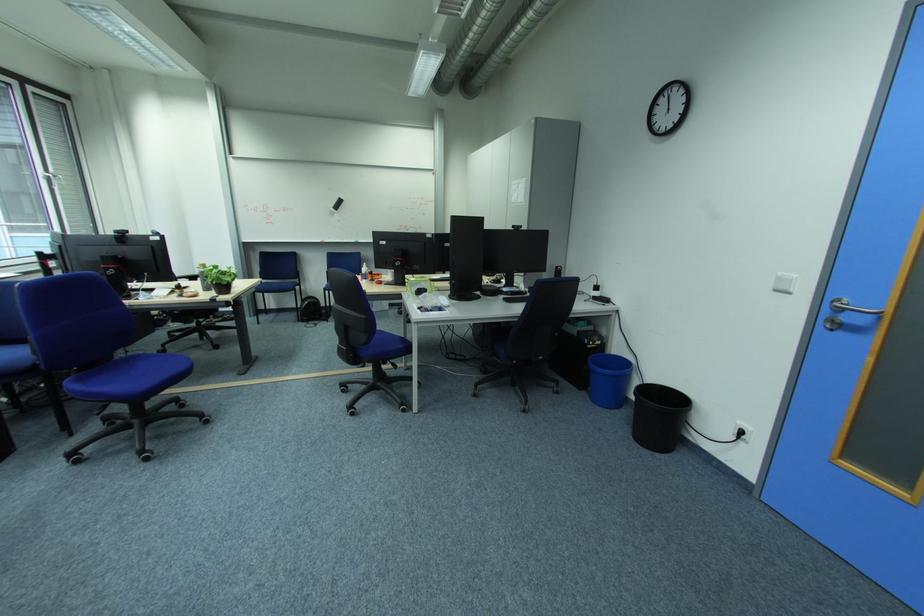
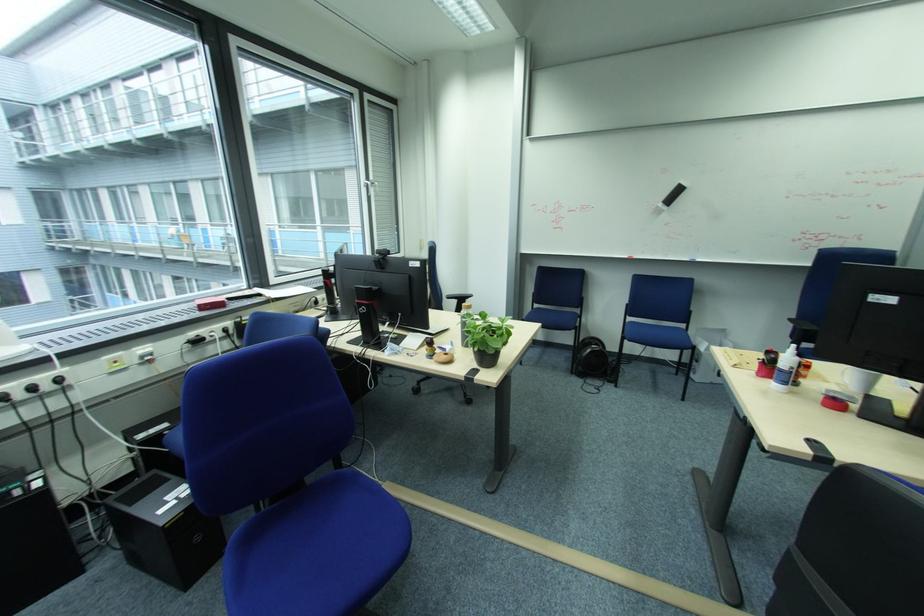
In the second image, find the point that corresponds to (x=372, y=282) in the first image.

(784, 387)